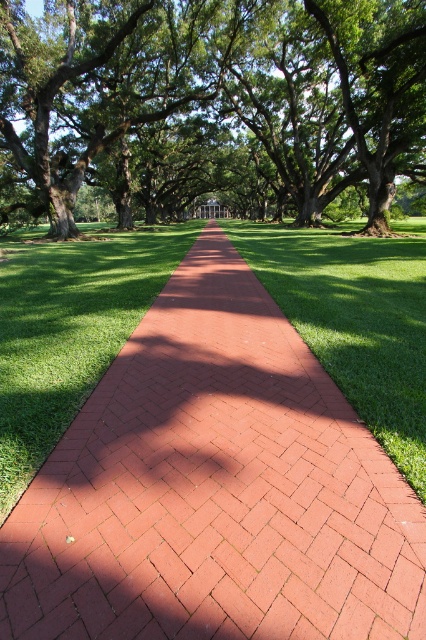
Question: Can you confirm if green leafy tree at center is positioned to the right of green grass at center?

Choices:
 (A) yes
 (B) no

Answer: (B)

Question: Does green leafy tree at center have a greater width compared to green grass at center?

Choices:
 (A) yes
 (B) no

Answer: (A)

Question: Is green leafy tree at center positioned in front of green grass at center?

Choices:
 (A) no
 (B) yes

Answer: (A)

Question: Which of the following is the closest to the observer?

Choices:
 (A) green grass at center
 (B) green leafy tree at center

Answer: (A)

Question: Among these objects, which one is farthest from the camera?

Choices:
 (A) green leafy tree at center
 (B) green grass at center

Answer: (A)